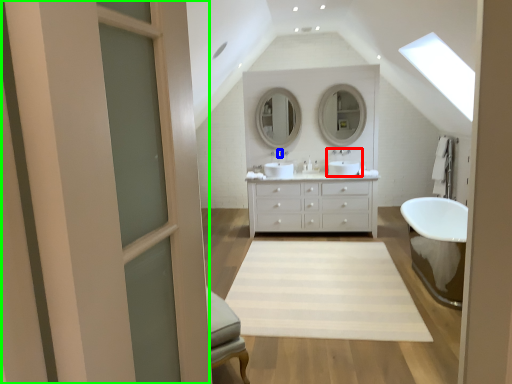
Question: Which object is positioned closest to sink (highlighted by a red box)? Select from faucet (highlighted by a blue box) and screen door (highlighted by a green box).

Choices:
 (A) faucet
 (B) screen door

Answer: (A)